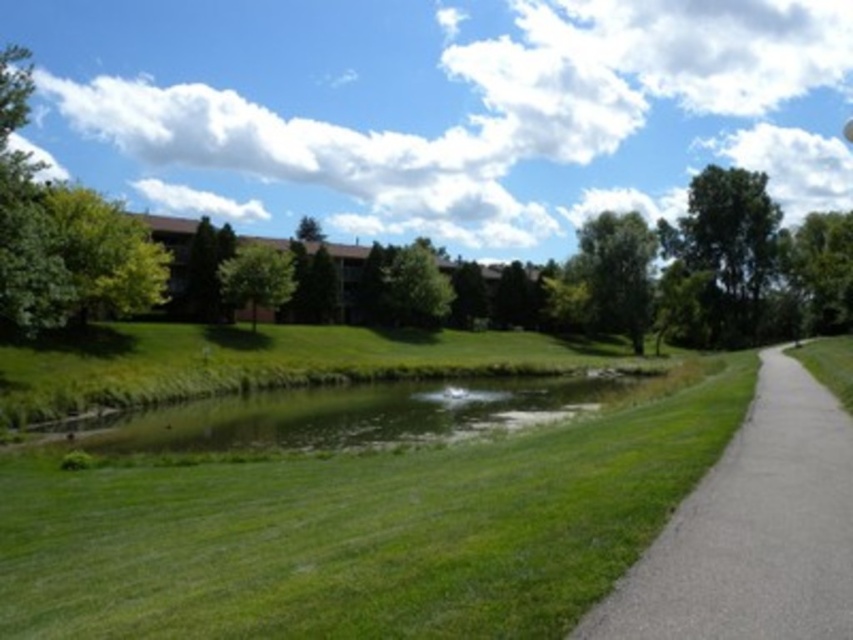
In the scene shown: Can you confirm if gray asphalt path at right is positioned above green grassy pond at center?

Correct, gray asphalt path at right is located above green grassy pond at center.

Is point (793, 390) farther from viewer compared to point (387, 385)?

No, it is in front of (387, 385).

Is point (820, 465) positioned behind point (462, 381)?

That is False.

You are a GUI agent. You are given a task and a screenshot of the screen. Output one action in this format:
    pyautogui.click(x=<x>, y=<y>)
    Task: Click on the gray asphalt path at right
    
    Given the screenshot: What is the action you would take?
    pyautogui.click(x=752, y=531)